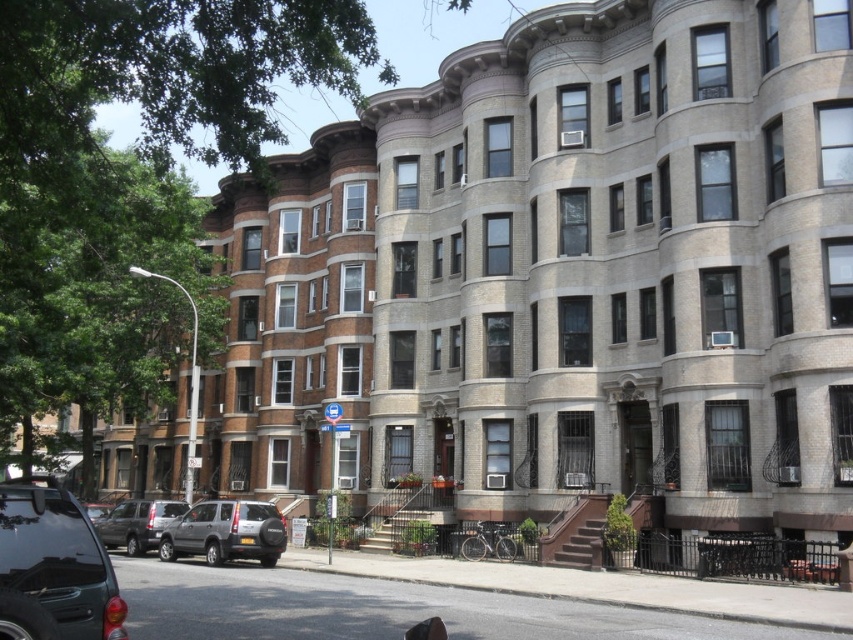
Is matte black suv at lower left positioned at the back of silver metallic suv at lower left?

No, it is not.

This screenshot has height=640, width=853. Find the location of `matte black suv at lower left`. matte black suv at lower left is located at coordinates (53, 570).

You are a GUI agent. You are given a task and a screenshot of the screen. Output one action in this format:
    pyautogui.click(x=<x>, y=<y>)
    Task: Click on the matte black suv at lower left
    
    Given the screenshot: What is the action you would take?
    pyautogui.click(x=53, y=570)

From the picture: Between matte black suv at lower left and shiny silver suv at center, which one is positioned lower?

Positioned lower is shiny silver suv at center.

Is point (26, 602) positioned before point (94, 504)?

Yes.

Which is in front, point (41, 566) or point (90, 509)?

Point (41, 566) is in front.

You are a GUI agent. You are given a task and a screenshot of the screen. Output one action in this format:
    pyautogui.click(x=<x>, y=<y>)
    Task: Click on the matte black suv at lower left
    
    Given the screenshot: What is the action you would take?
    pyautogui.click(x=53, y=570)

Looking at this image, does matte black suv at lower left appear under silver metallic suv at center?

No, matte black suv at lower left is not below silver metallic suv at center.

Who is more forward, (x=9, y=552) or (x=283, y=525)?

Positioned in front is point (x=9, y=552).

This screenshot has height=640, width=853. I want to click on matte black suv at lower left, so click(x=53, y=570).